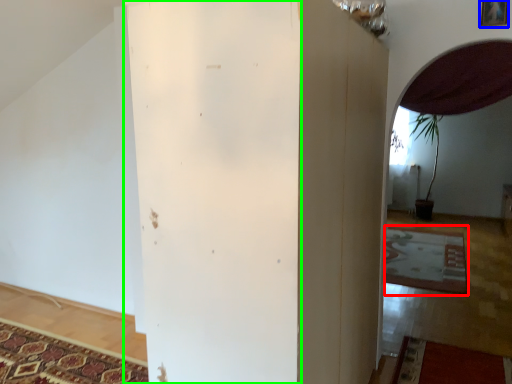
Question: Which is nearer to the mat (highlighted by a red box)? picture frame (highlighted by a blue box) or pillar (highlighted by a green box).

Choices:
 (A) picture frame
 (B) pillar

Answer: (A)